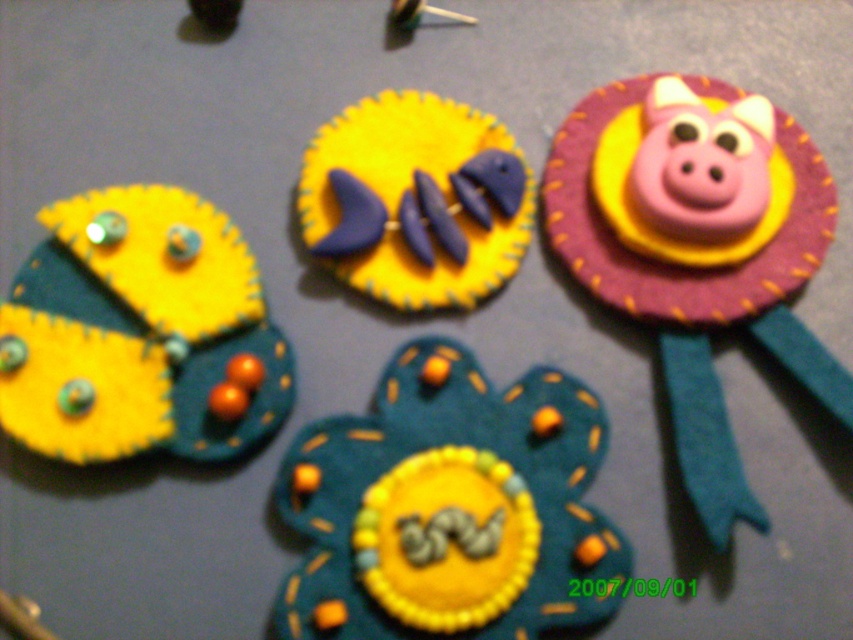
Question: Which point appears closest to the camera in this image?

Choices:
 (A) (79, 266)
 (B) (526, 196)
 (C) (286, 580)

Answer: (C)

Question: Is yellow felt butterfly at left bigger than yellow felt fish at center?

Choices:
 (A) no
 (B) yes

Answer: (B)

Question: Which point is farther to the camera?

Choices:
 (A) (431, 202)
 (B) (662, 355)

Answer: (A)

Question: Among these objects, which one is nearest to the camera?

Choices:
 (A) yellow felt butterfly at left
 (B) yellow felt fish at center

Answer: (A)

Question: Is teal felt flower at center below yellow felt butterfly at left?

Choices:
 (A) no
 (B) yes

Answer: (B)

Question: Is teal felt flower at center above yellow felt fish at center?

Choices:
 (A) no
 (B) yes

Answer: (A)